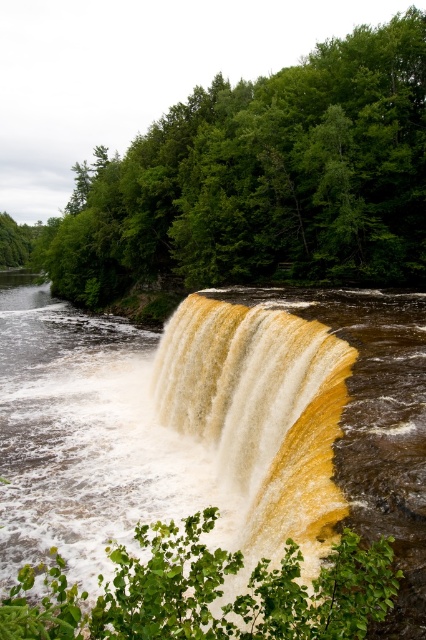
You are standing at the edge of the river and want to take a photo of the brown textured waterfall at center. Based on your position, is the waterfall to your left, right, front, or behind you?

The brown textured waterfall at center is located at point coordinates that would place it directly in front of you if you are positioned at the river edge facing the waterfall. Since the coordinates are at the center of the image, it would be straight ahead, so the answer is front.

You are standing at the edge of the river and want to take a photo of the brown textured waterfall at center and the yellowish water at center. Which object should you focus on first to ensure both are in clear view?

You should focus on the brown textured waterfall at center first since it is closer to you than the yellowish water at center, ensuring both are in focus when using a camera with depth of field considerations.

You are a hiker standing at the edge of the river near the waterfall. You notice the green leafy trees at center and the yellowish water at center. Which object is located above the other?

The green leafy trees at center are positioned over the yellowish water at center, meaning the trees are above the water.